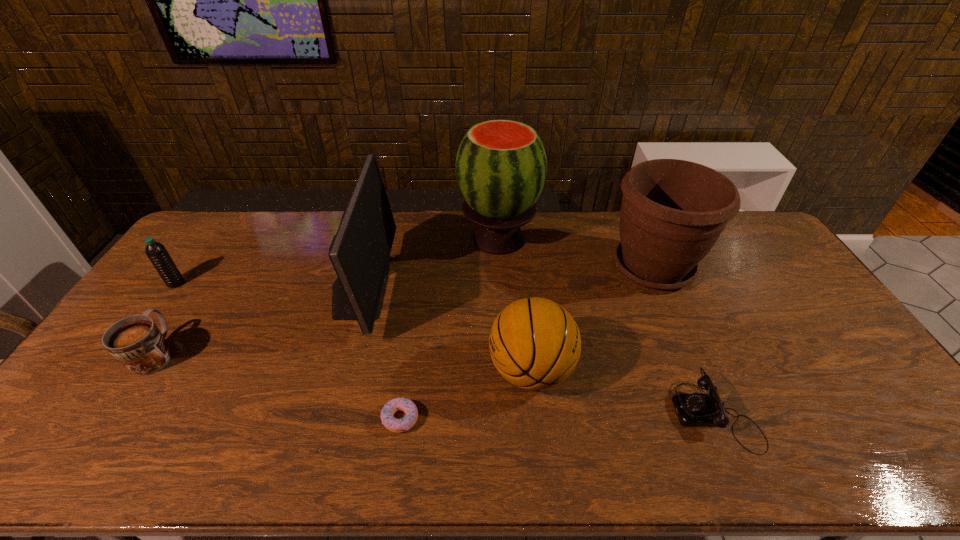
Identify the location of the tallest object. (501, 166).

Where is `computer monitor`? computer monitor is located at coordinates (360, 251).

Find the location of a particular element. This screenshot has height=540, width=960. flowerpot is located at coordinates (673, 211).

Identify the location of the fourth tallest object. The width and height of the screenshot is (960, 540). point(535,344).

Locate an element on the screen. Image resolution: width=960 pixels, height=540 pixels. the leftmost object is located at coordinates (156, 252).

Where is `water bottle`? water bottle is located at coordinates (156, 252).

Locate an element on the screen. This screenshot has height=540, width=960. the second object from left to right is located at coordinates (136, 342).

Locate an element on the screen. mug is located at coordinates (136, 342).

Locate an element on the screen. The image size is (960, 540). telephone is located at coordinates (695, 409).

Locate an element on the screen. the fourth object from left to right is located at coordinates (388, 420).